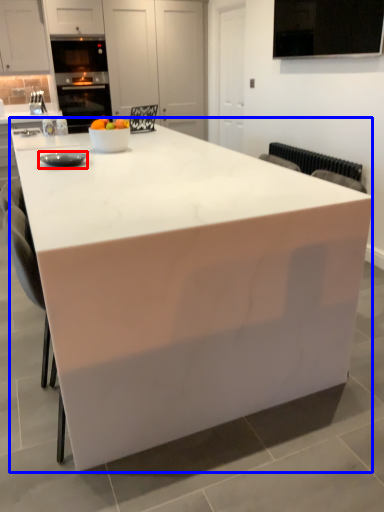
Question: Which point is closer to the camera, appliance (highlighted by a red box) or table (highlighted by a blue box)?

Choices:
 (A) appliance
 (B) table

Answer: (B)